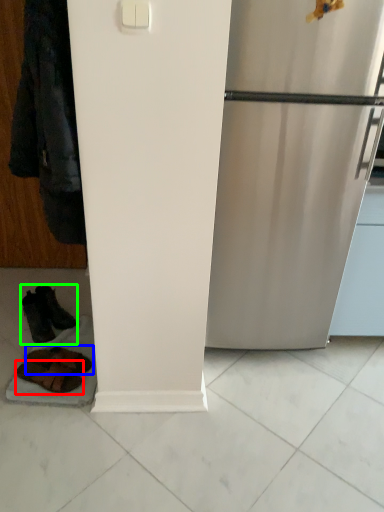
Question: Based on their relative distances, which object is nearer to footwear (highlighted by a red box)? Choose from footwear (highlighted by a blue box) and footwear (highlighted by a green box).

Choices:
 (A) footwear
 (B) footwear

Answer: (A)